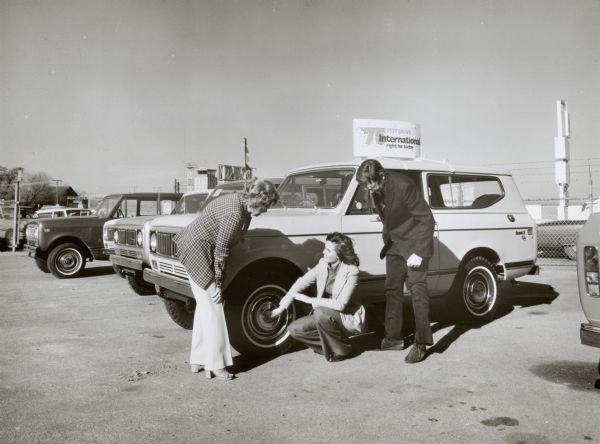
What are the coordinates of `window` in the screenshot? It's located at (468, 190).